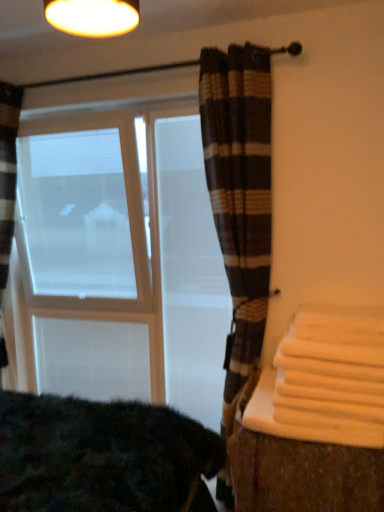
Question: Could you tell me if white matte window screen at left is facing white frosted glass bay window at left?

Choices:
 (A) no
 (B) yes

Answer: (B)

Question: Is white matte window screen at left located outside white frosted glass bay window at left?

Choices:
 (A) yes
 (B) no

Answer: (B)

Question: Is white matte window screen at left thinner than white frosted glass bay window at left?

Choices:
 (A) yes
 (B) no

Answer: (A)

Question: Can you confirm if white matte window screen at left is bigger than white frosted glass bay window at left?

Choices:
 (A) yes
 (B) no

Answer: (B)

Question: Is white matte window screen at left facing away from white frosted glass bay window at left?

Choices:
 (A) no
 (B) yes

Answer: (B)

Question: Is white matte window screen at left next to white frosted glass bay window at left?

Choices:
 (A) yes
 (B) no

Answer: (B)

Question: Is white matte window screen at left to the right of dark textured blanket at lower left from the viewer's perspective?

Choices:
 (A) yes
 (B) no

Answer: (B)

Question: From the image's perspective, does white matte window screen at left appear higher than dark textured blanket at lower left?

Choices:
 (A) yes
 (B) no

Answer: (A)

Question: From the image's perspective, is white matte window screen at left under dark textured blanket at lower left?

Choices:
 (A) yes
 (B) no

Answer: (B)

Question: Is white matte window screen at left far from dark textured blanket at lower left?

Choices:
 (A) no
 (B) yes

Answer: (B)

Question: Is white matte window screen at left thinner than dark textured blanket at lower left?

Choices:
 (A) yes
 (B) no

Answer: (A)

Question: Could you tell me if white matte window screen at left is turned towards dark textured blanket at lower left?

Choices:
 (A) no
 (B) yes

Answer: (B)

Question: Is white fabric at right positioned far away from dark textured blanket at lower left?

Choices:
 (A) no
 (B) yes

Answer: (A)